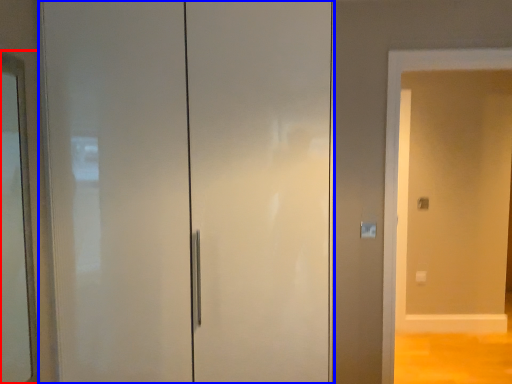
Question: Which object is closer to the camera taking this photo, mirror (highlighted by a red box) or door (highlighted by a blue box)?

Choices:
 (A) mirror
 (B) door

Answer: (A)